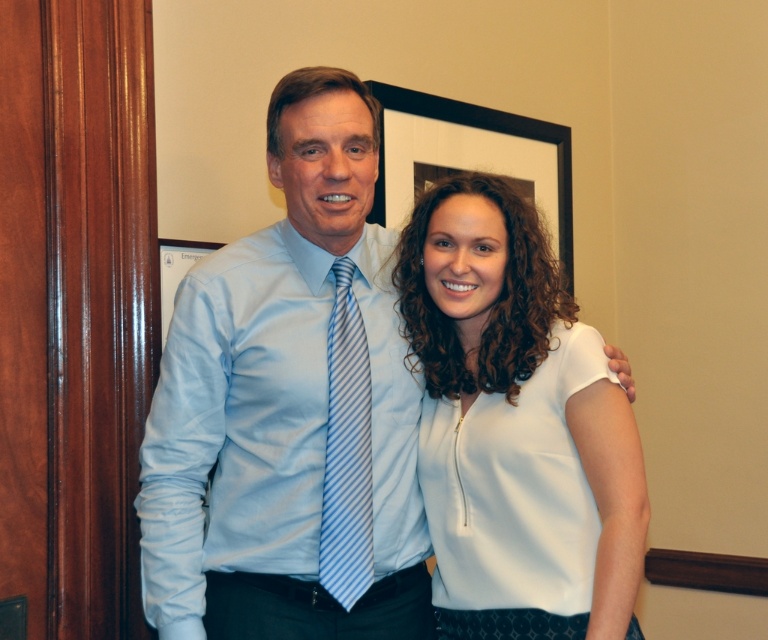
Question: Which object appears farthest from the camera in this image?

Choices:
 (A) blue striped tie at center
 (B) black matte picture frame at upper center
 (C) light blue satin dress shirt at center

Answer: (B)

Question: Among these objects, which one is nearest to the camera?

Choices:
 (A) light blue shirt at center
 (B) matte blue shirt at left
 (C) light blue satin dress shirt at center

Answer: (A)

Question: Can you confirm if light blue satin dress shirt at center is positioned below blue striped tie at center?

Choices:
 (A) no
 (B) yes

Answer: (A)

Question: Observing the image, what is the correct spatial positioning of light blue shirt at center in reference to black matte picture frame at upper center?

Choices:
 (A) above
 (B) below

Answer: (B)

Question: Which of the following is the farthest from the observer?

Choices:
 (A) (214, 429)
 (B) (508, 481)

Answer: (A)

Question: Is white smooth blouse at center to the right of black matte picture frame at upper center from the viewer's perspective?

Choices:
 (A) yes
 (B) no

Answer: (B)